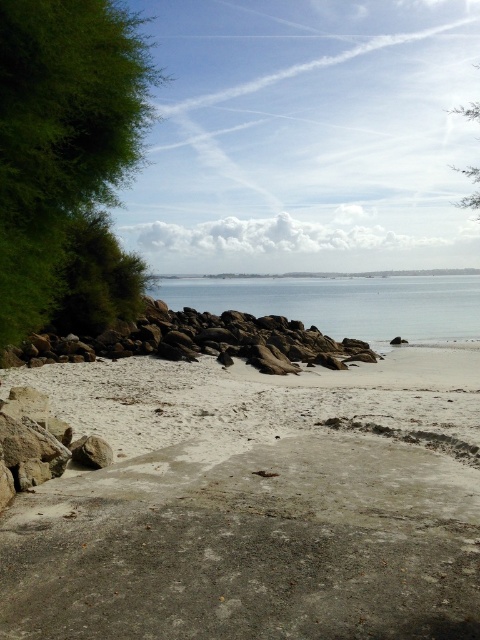
You are standing at the center of the image and want to reach the gray concrete beach at lower left. Which direction should you move in to get there?

You should move towards the lower left direction to reach the gray concrete beach at lower left as it is located at point [253,508].

You are standing at the center of the image and want to walk towards the green leafy tree at left. In which direction should you head?

The green leafy tree at left is located at coordinates (61, 132), so you should head towards the left direction to reach it.